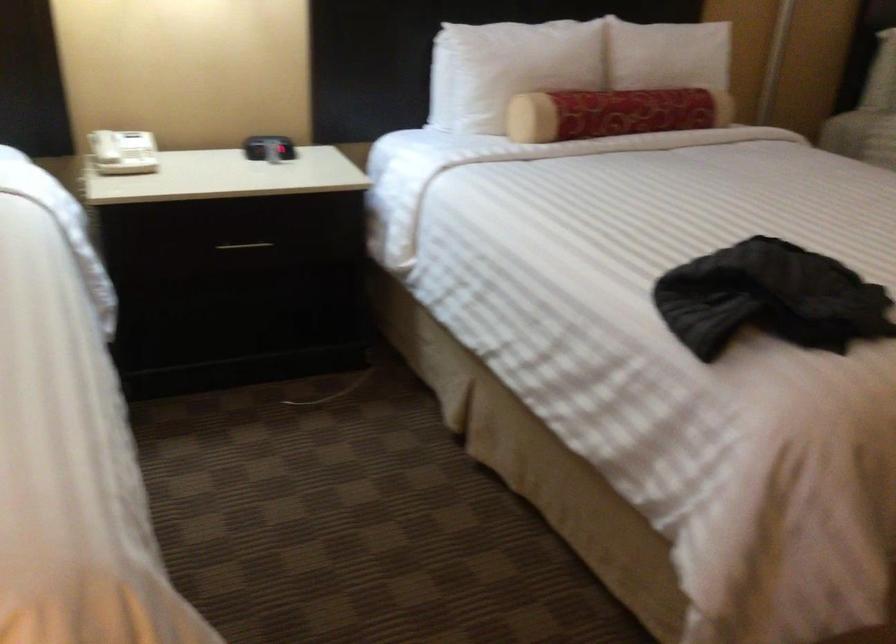
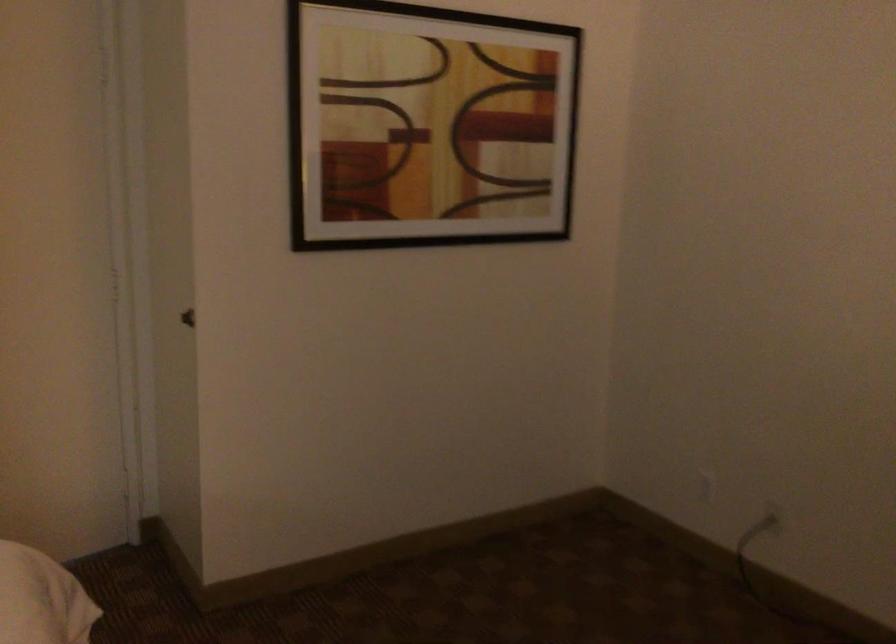
Question: The images are taken continuously from a first-person perspective. In which direction is your viewpoint rotating?

Choices:
 (A) Left
 (B) Right
 (C) Up
 (D) Down

Answer: (B)